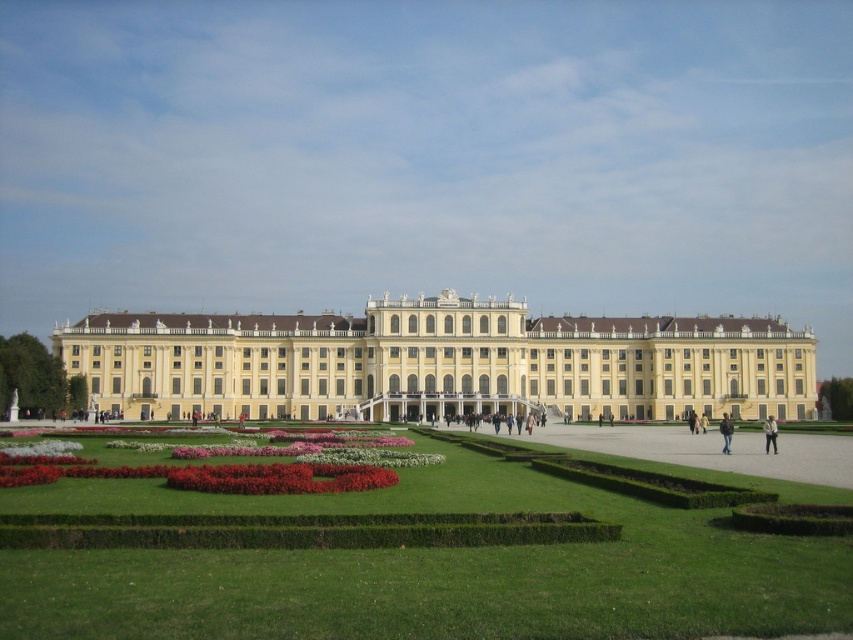
Who is more distant from viewer, (573, 612) or (4, 387)?

The point (4, 387) is behind.

Who is shorter, green grass at center or green hedge at left?

green grass at center is shorter.

The image size is (853, 640). Find the location of `green grass at center`. green grass at center is located at coordinates (426, 570).

Who is taller, green grass at center or white cotton shirt at center?

With more height is green grass at center.

Is green grass at center closer to camera compared to white cotton shirt at center?

That is True.

Find the location of a particular element. This screenshot has width=853, height=640. green grass at center is located at coordinates (426, 570).

Is point (202, 413) positioned before point (724, 452)?

No, (202, 413) is further to viewer.

Does yellow matte building at center have a greater width compared to brown leather jacket at center?

Yes, yellow matte building at center is wider than brown leather jacket at center.

The width and height of the screenshot is (853, 640). What are the coordinates of `yellow matte building at center` in the screenshot? It's located at (439, 364).